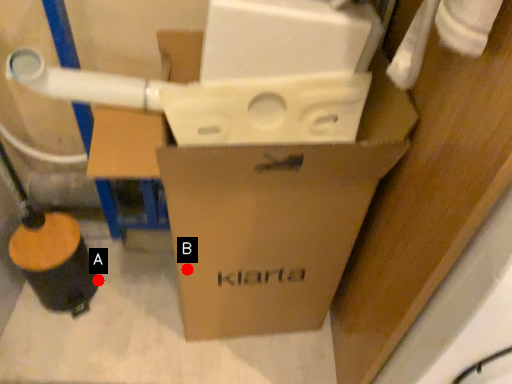
Question: Two points are circled on the image, labeled by A and B beside each circle. Which point is closer to the camera taking this photo?

Choices:
 (A) A is closer
 (B) B is closer

Answer: (B)